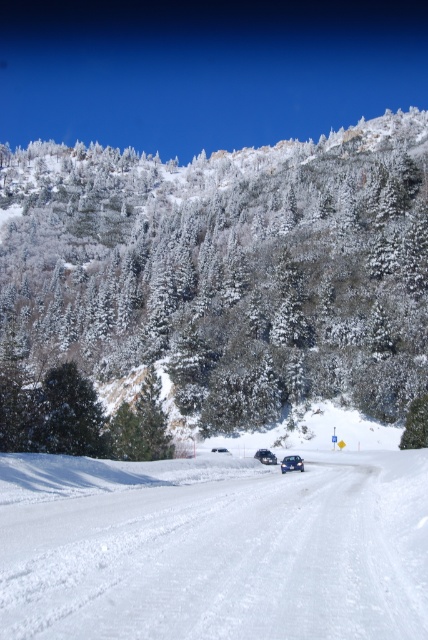
Question: Among these objects, which one is farthest from the camera?

Choices:
 (A) white snow ski slope at center
 (B) green matte tree at upper center

Answer: (B)

Question: Is green matte tree at upper center bigger than white snow ski slope at center?

Choices:
 (A) no
 (B) yes

Answer: (B)

Question: Is green matte tree at upper center further to camera compared to white snow ski slope at center?

Choices:
 (A) no
 (B) yes

Answer: (B)

Question: Can you confirm if green matte tree at upper center is positioned to the right of white snow ski slope at center?

Choices:
 (A) yes
 (B) no

Answer: (A)

Question: Which of the following is the farthest from the observer?

Choices:
 (A) green matte tree at upper center
 (B) white snow ski slope at center

Answer: (A)